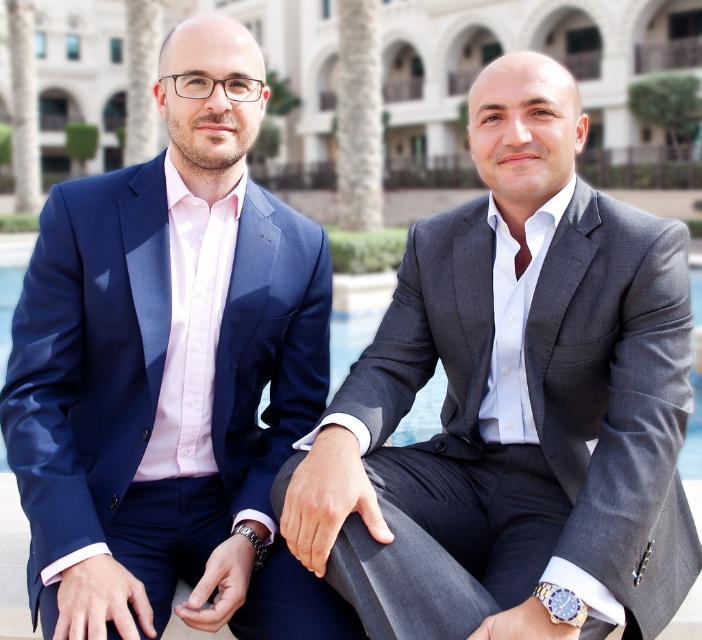
Measure the distance between gray textured suit at center and camera.

gray textured suit at center is 15.18 meters away from camera.

At what (x,y) coordinates should I click in order to perform the action: click on gray textured suit at center. Please return your answer as a coordinate pair (x, y). Image resolution: width=702 pixels, height=640 pixels. Looking at the image, I should click on (512, 403).